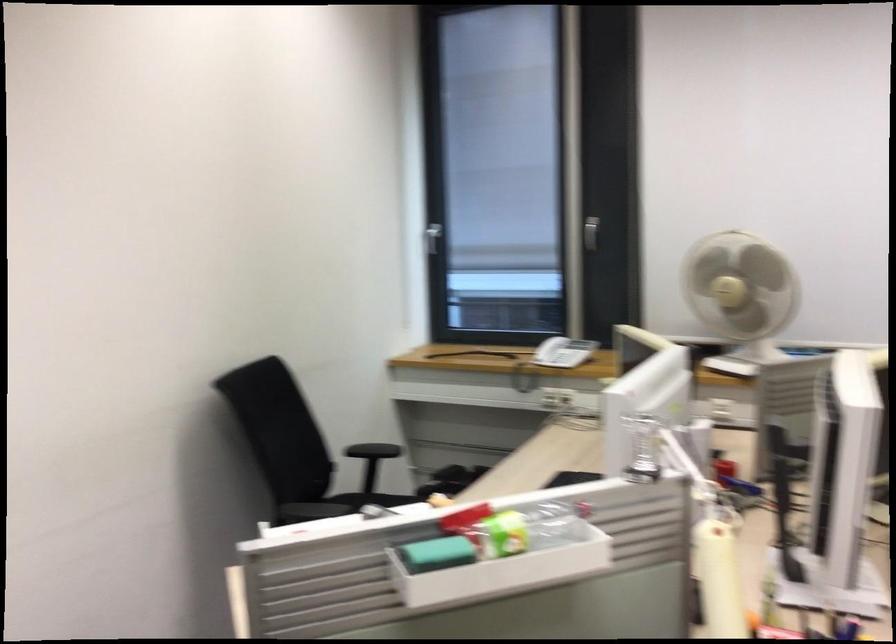
Image resolution: width=896 pixels, height=644 pixels. What do you see at coordinates (371, 451) in the screenshot?
I see `the black chair armrest` at bounding box center [371, 451].